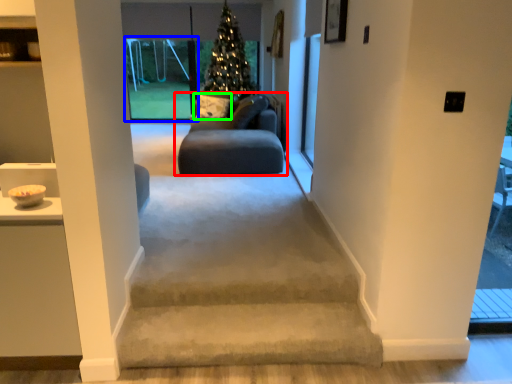
Question: Which is farther away from studio couch (highlighted by a red box)? window (highlighted by a blue box) or pillow (highlighted by a green box)?

Choices:
 (A) window
 (B) pillow

Answer: (A)